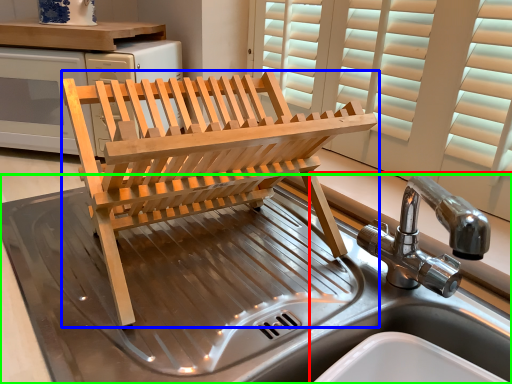
Question: Considering the real-world distances, which object is farthest from sink (highlighted by a red box)? furniture (highlighted by a blue box) or sink (highlighted by a green box)?

Choices:
 (A) furniture
 (B) sink

Answer: (B)